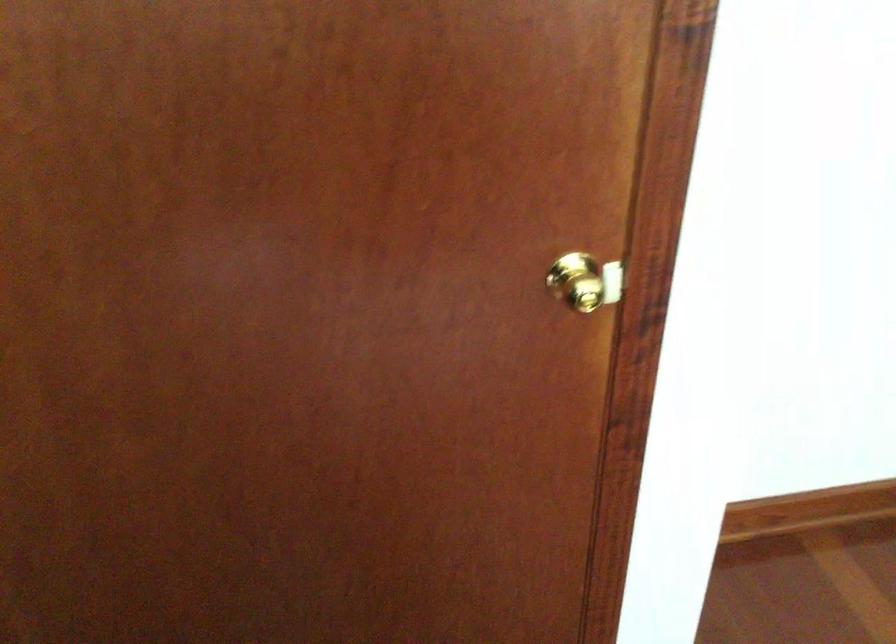
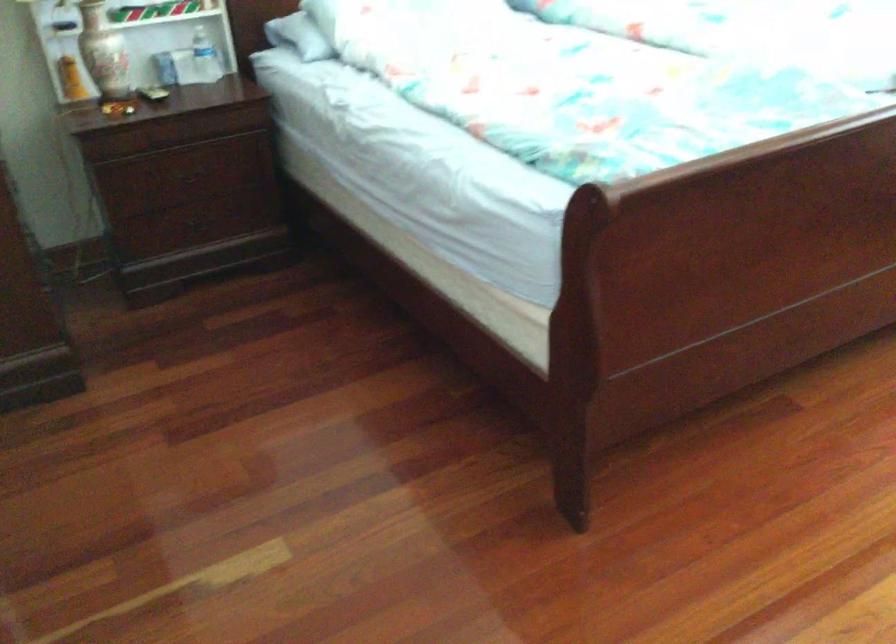
Based on the continuous images, in which direction is the camera rotating?

The camera rotated toward right-down.